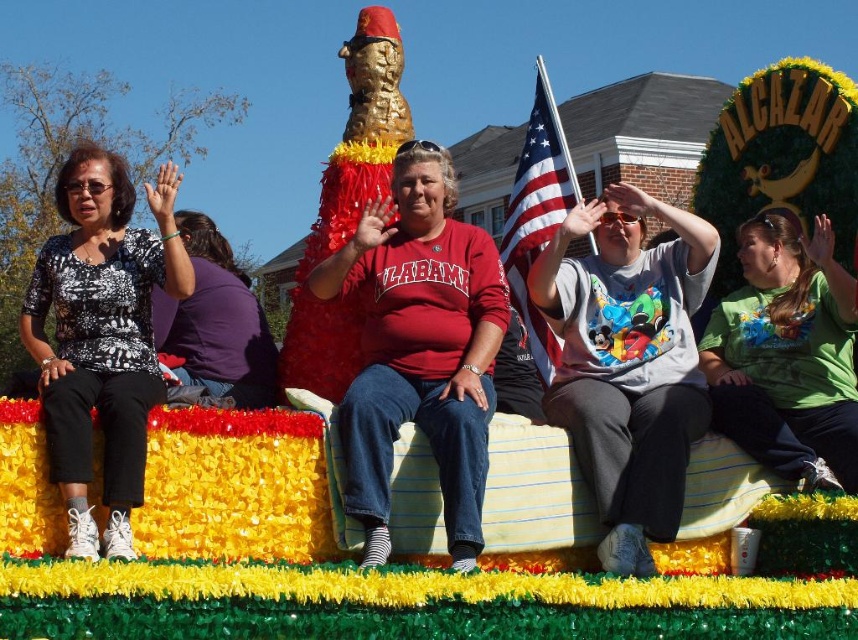
You are a photographer at the parade and want to capture both the green matte shirt at center and the matte purple shirt at center in your photo. Which shirt should you focus on to ensure both are in frame?

Since the green matte shirt at center is larger than the matte purple shirt at center, you should focus on the green matte shirt at center to ensure both are in frame as it will take up more space, allowing the smaller purple one to fit alongside.

You are a photographer standing in front of the float. You want to take a photo that includes both the printed fabric blouse at left and the american flag at center. Which object should you position closer to the edge of your camera frame to ensure both fit in the shot?

Since the printed fabric blouse at left is narrower than the american flag at center, you should position the american flag at center closer to the edge of your camera frame to ensure both fit in the shot.

You are standing at the parade watching the float with the golden cat statue. There are two points marked on the float at coordinates point (367,525) and point (826,275). Which of these points is closer to you?

Point (367,525) is closer to the camera than point (826,275), so the point closer to you is point (367,525).